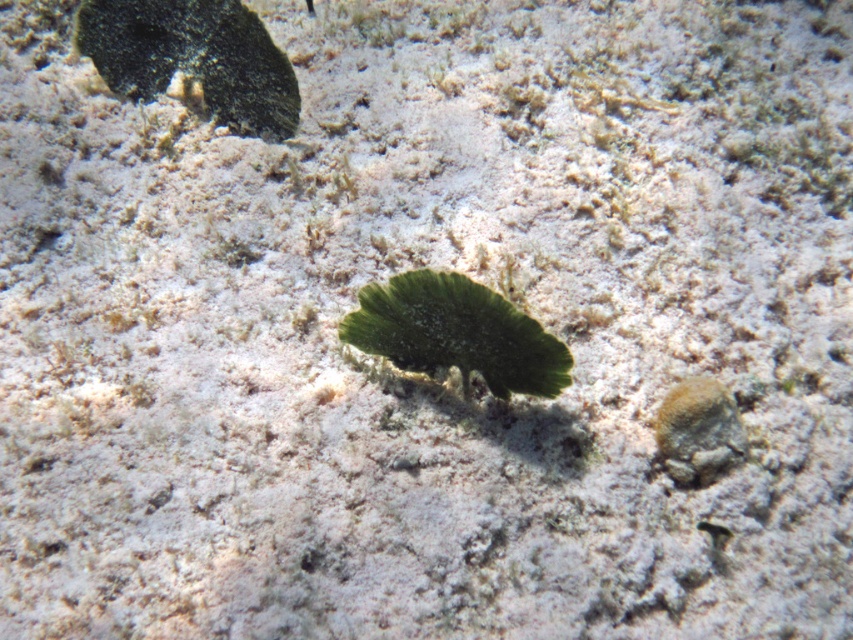
The height and width of the screenshot is (640, 853). What do you see at coordinates (193, 58) in the screenshot?
I see `smooth dark green leaf at upper left` at bounding box center [193, 58].

How distant is smooth dark green leaf at upper left from green leafy algae at center?

smooth dark green leaf at upper left and green leafy algae at center are 20.91 inches apart.

The width and height of the screenshot is (853, 640). What do you see at coordinates (193, 58) in the screenshot?
I see `smooth dark green leaf at upper left` at bounding box center [193, 58].

Where is `smooth dark green leaf at upper left`? This screenshot has width=853, height=640. smooth dark green leaf at upper left is located at coordinates (193, 58).

Between point (506, 307) and point (664, 464), which one is positioned in front?

Positioned in front is point (506, 307).

Between green leafy algae at center and rusty metallic rock at lower right, which one is positioned lower?

rusty metallic rock at lower right

Is point (496, 301) positioned in front of point (704, 461)?

Yes, it is in front of point (704, 461).

Identify the location of green leafy algae at center. The width and height of the screenshot is (853, 640). (457, 333).

Measure the distance between point (128, 3) and camera.

The distance of point (128, 3) from camera is 5.09 feet.

From the picture: Who is lower down, smooth dark green leaf at upper left or rusty metallic rock at lower right?

Positioned lower is rusty metallic rock at lower right.

Locate an element on the screen. smooth dark green leaf at upper left is located at coordinates (193, 58).